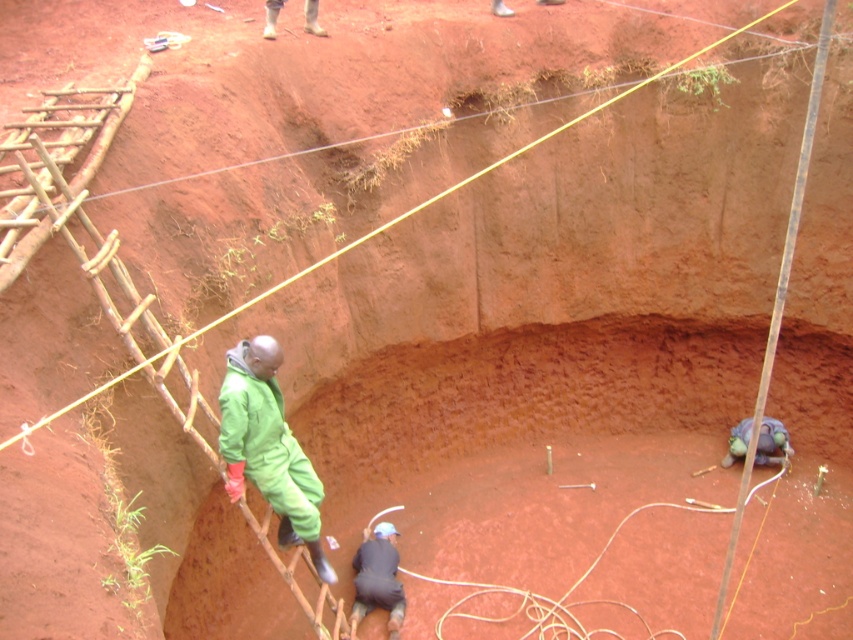
This screenshot has height=640, width=853. What do you see at coordinates (268, 448) in the screenshot? I see `green matte jumpsuit at center` at bounding box center [268, 448].

Image resolution: width=853 pixels, height=640 pixels. I want to click on green matte jumpsuit at center, so click(268, 448).

Is green matte jumpsuit at center in front of purple fabric at lower right?

Yes, it is in front of purple fabric at lower right.

Does green matte jumpsuit at center come behind purple fabric at lower right?

No.

Image resolution: width=853 pixels, height=640 pixels. What do you see at coordinates (268, 448) in the screenshot?
I see `green matte jumpsuit at center` at bounding box center [268, 448].

Identify the location of green matte jumpsuit at center. The width and height of the screenshot is (853, 640). (268, 448).

Does purple fabric at lower right have a lesser width compared to brown leather boots at upper center?

No.

Is purple fabric at lower right shorter than brown leather boots at upper center?

In fact, purple fabric at lower right may be taller than brown leather boots at upper center.

Does point (769, 464) come behind point (315, 1)?

Yes, it is.

Identify the location of purple fabric at lower right. The width and height of the screenshot is (853, 640). (770, 442).